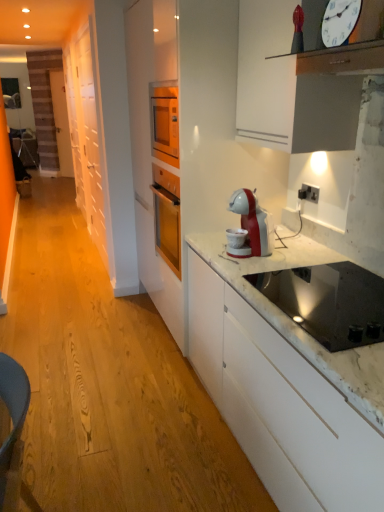
Question: Choose the correct answer: Is white matte cabinet at left inside white plastic electric outlet at upper right or outside it?

Choices:
 (A) outside
 (B) inside

Answer: (A)

Question: In the image, is white matte cabinet at left positioned in front of or behind white plastic electric outlet at upper right?

Choices:
 (A) front
 (B) behind

Answer: (B)

Question: Estimate the real-world distances between objects in this image. Which object is closer to the white plastic clock at upper right?

Choices:
 (A) white plastic electric outlet at upper right
 (B) black glass cooktop at lower right
 (C) white matte cabinet at left

Answer: (B)

Question: Estimate the real-world distances between objects in this image. Which object is closer to the white plastic electric outlet at upper right?

Choices:
 (A) white plastic clock at upper right
 (B) black glass cooktop at lower right
 (C) white matte cabinet at left

Answer: (B)